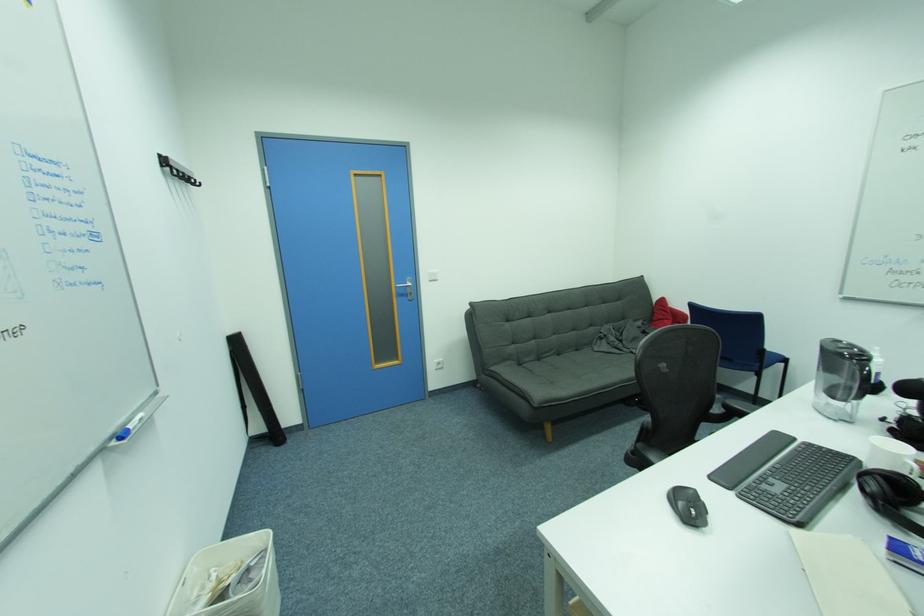
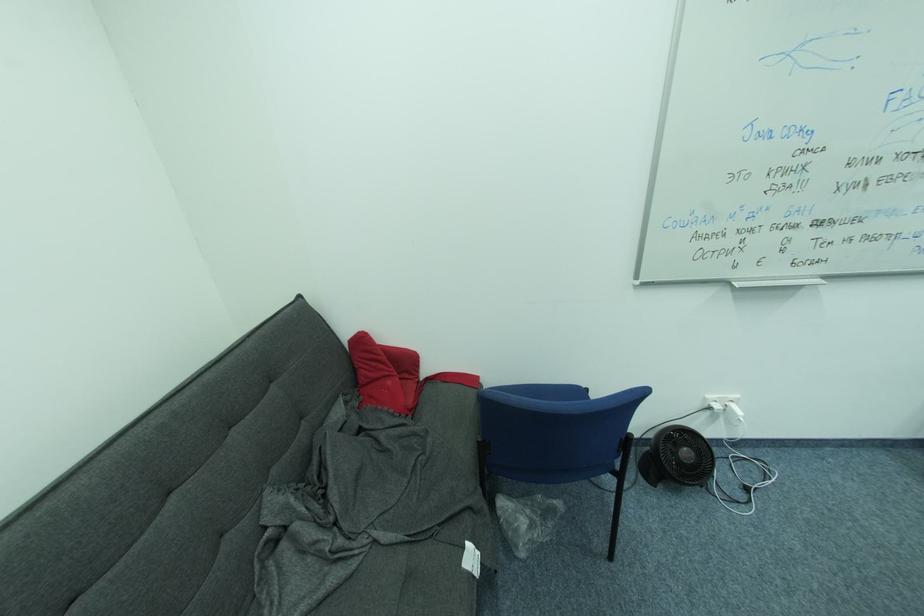
Find the pixel in the second image that matches (x=662, y=300) in the first image.

(353, 336)